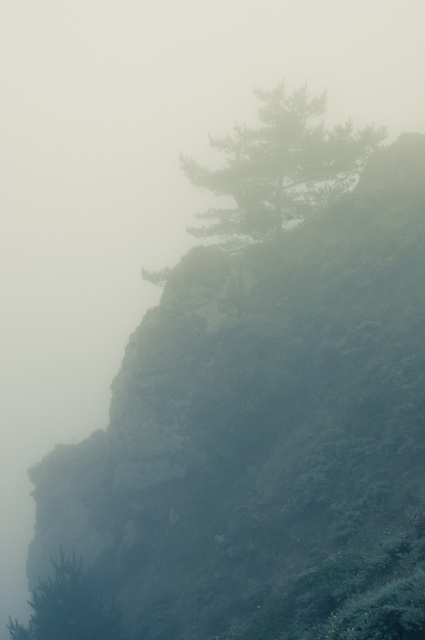
Which is below, green matte tree at upper center or green matte tree at lower left?

green matte tree at lower left

Which is above, green matte tree at upper center or green matte tree at lower left?

green matte tree at upper center

I want to click on green matte tree at upper center, so click(x=280, y=166).

Where is `green matte tree at upper center`? green matte tree at upper center is located at coordinates (280, 166).